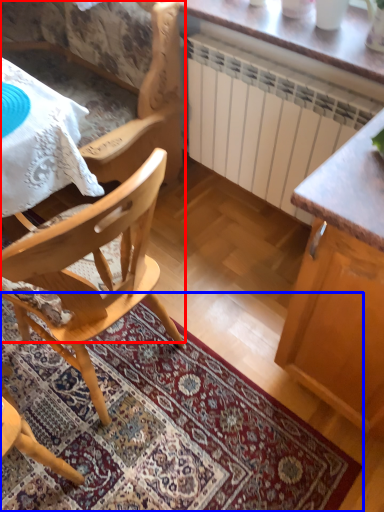
Question: Which object is further to the camera taking this photo, chair (highlighted by a red box) or mat (highlighted by a blue box)?

Choices:
 (A) chair
 (B) mat

Answer: (A)